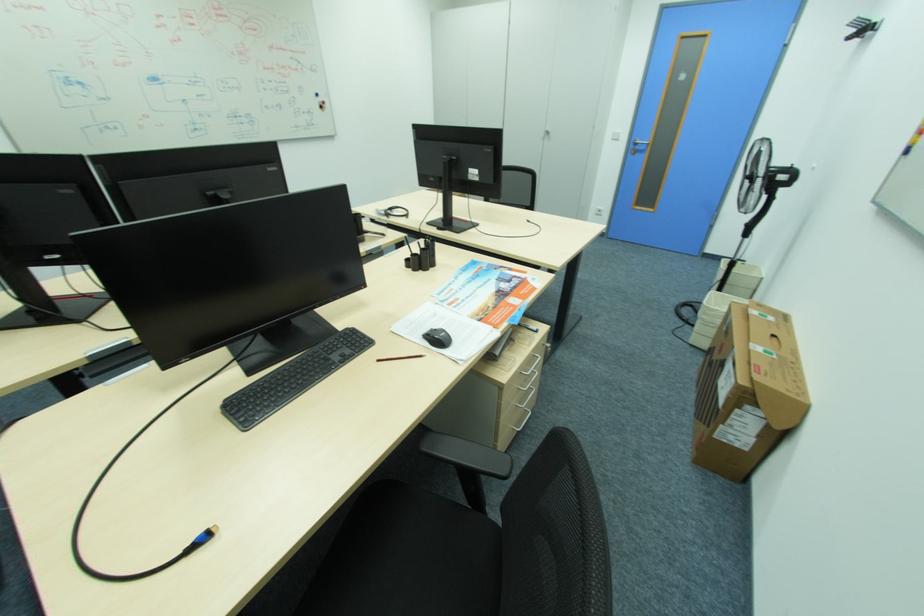
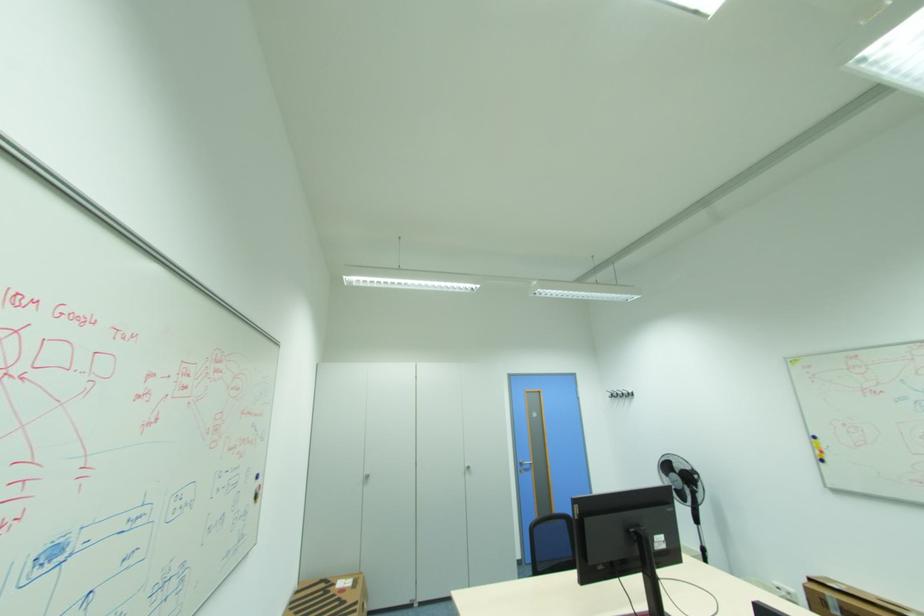
Locate, in the second image, the point that corresponds to point 642,148 in the first image.

(529, 467)